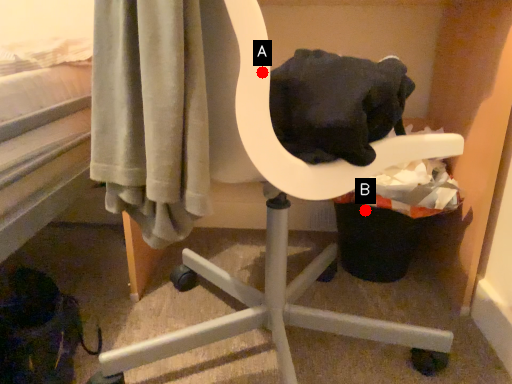
Question: Two points are circled on the image, labeled by A and B beside each circle. Which point is closer to the camera taking this photo?

Choices:
 (A) A is closer
 (B) B is closer

Answer: (A)